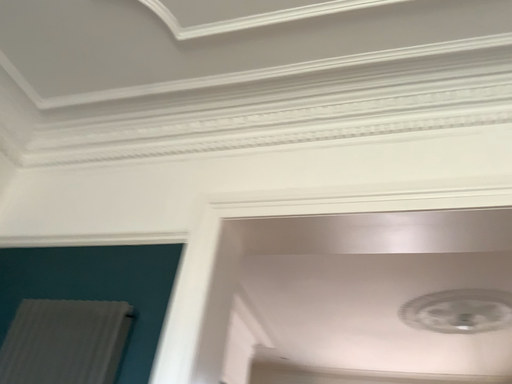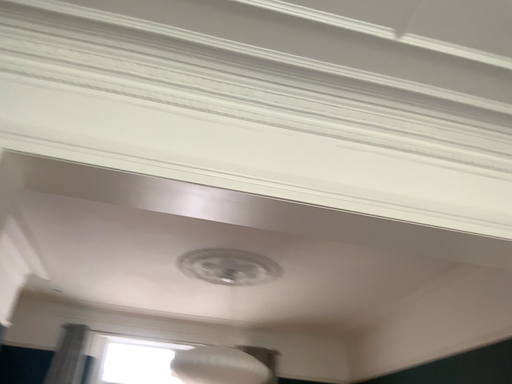
Question: How did the camera likely rotate when shooting the video?

Choices:
 (A) rotated downward
 (B) rotated upward

Answer: (A)